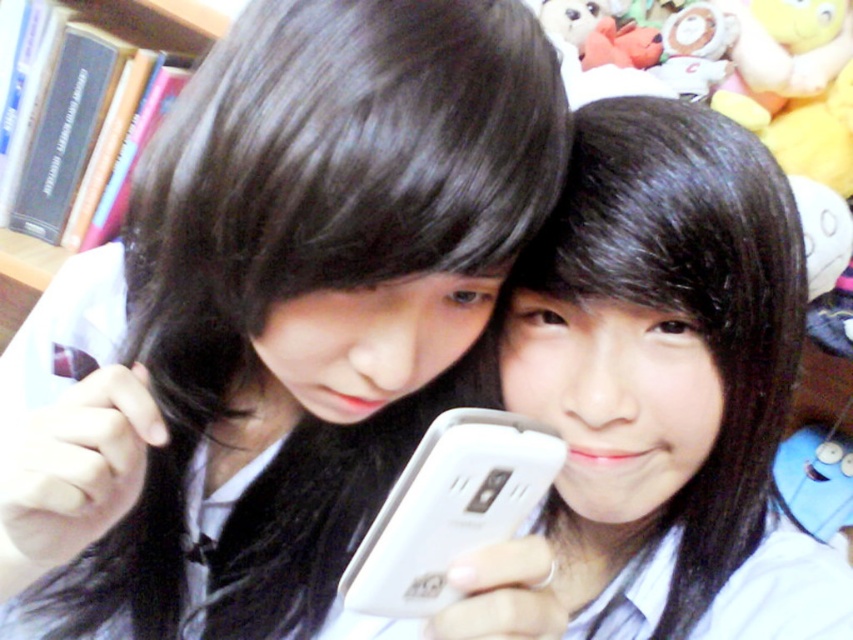
Question: Does white matte phone at center have a lesser width compared to white plastic smartphone at center?

Choices:
 (A) no
 (B) yes

Answer: (A)

Question: Among these points, which one is nearest to the camera?

Choices:
 (A) (721, 538)
 (B) (390, 490)

Answer: (A)

Question: Does white matte phone at center have a larger size compared to white plastic smartphone at center?

Choices:
 (A) yes
 (B) no

Answer: (A)

Question: Which point appears closest to the camera in this image?

Choices:
 (A) (509, 444)
 (B) (549, 536)

Answer: (A)

Question: From the image, what is the correct spatial relationship of white matte phone at center in relation to white plastic smartphone at center?

Choices:
 (A) below
 (B) above

Answer: (B)